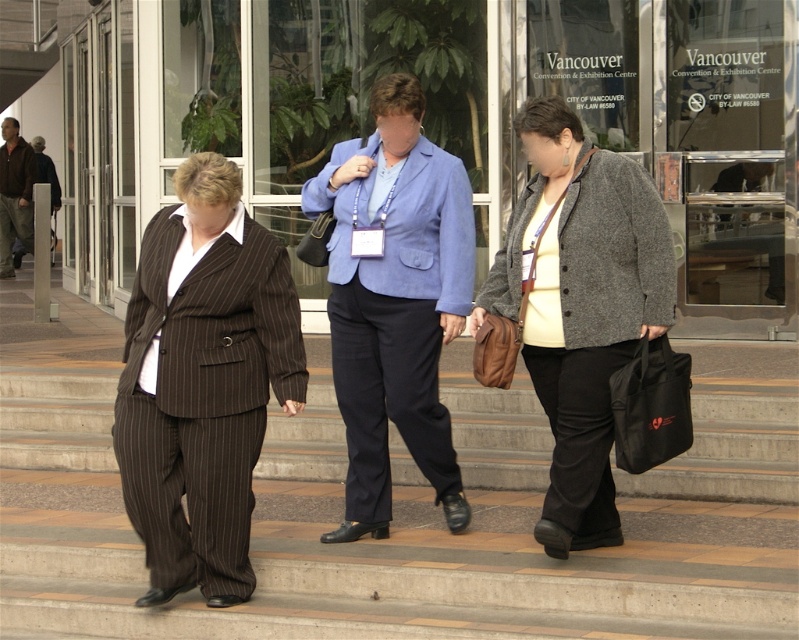
Between point (173, 305) and point (342, 388), which one is positioned behind?

The point (342, 388) is behind.

Where is `brown pinstripe suit at center`? The image size is (799, 640). brown pinstripe suit at center is located at coordinates (201, 381).

Find the location of `brown pinstripe suit at center`. brown pinstripe suit at center is located at coordinates 201,381.

Is brown pinstripe suit at center wider than brown leather jacket at left?

Yes, brown pinstripe suit at center is wider than brown leather jacket at left.

Can you confirm if brown pinstripe suit at center is positioned below brown leather jacket at left?

Correct, brown pinstripe suit at center is located below brown leather jacket at left.

Does point (229, 420) come behind point (12, 192)?

That is False.

Where is `brown pinstripe suit at center`? brown pinstripe suit at center is located at coordinates (201, 381).

This screenshot has height=640, width=799. What do you see at coordinates (579, 305) in the screenshot? I see `gray woolen jacket at center` at bounding box center [579, 305].

Is gray woolen jacket at center closer to the viewer compared to brown leather jacket at left?

Yes, it is.

Identify the location of gray woolen jacket at center. (579, 305).

You are a GUI agent. You are given a task and a screenshot of the screen. Output one action in this format:
    pyautogui.click(x=<x>, y=<y>)
    Task: Click on the gray woolen jacket at center
    This screenshot has height=640, width=799.
    Given the screenshot: What is the action you would take?
    pyautogui.click(x=579, y=305)